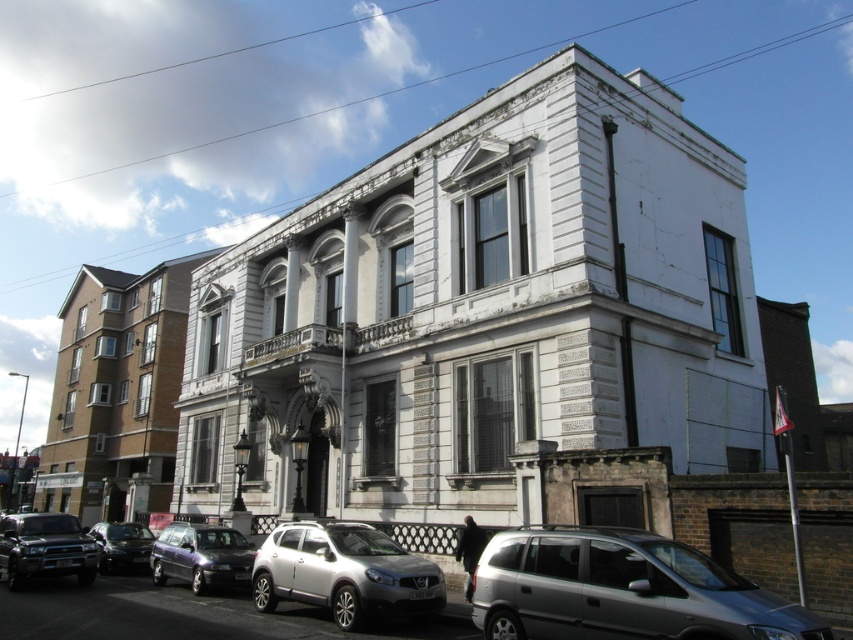
You are standing on the paved street in front of the two story building and see two points marked on the ground. The first point is at coordinates point (637,593) and the second point is at coordinates point (339,596). Which point is closer to the building?

Point (637,593) is in front of point (339,596), so the first point is closer to the building.

You are a delivery driver who needs to park your van between the metallic purple car at lower left and the shiny black sedan at lower left. Can you fit your van, which is 6 meters long, in the space between them?

The metallic purple car at lower left is above the shiny black sedan at lower left, so there is no space between them for the van to park. The van cannot fit between them.